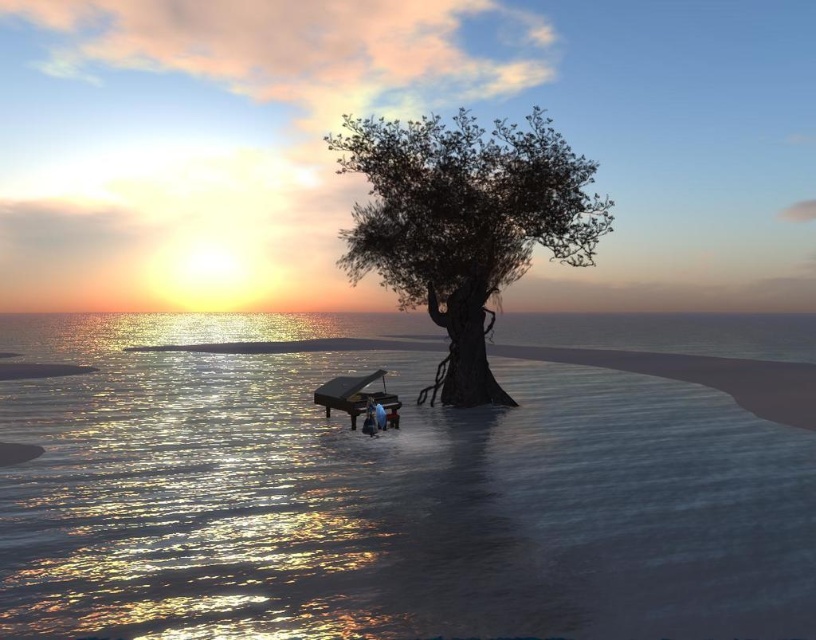
Can you confirm if shiny reflective water at center is shorter than green matte tree at center?

Indeed, shiny reflective water at center has a lesser height compared to green matte tree at center.

Can you confirm if shiny reflective water at center is positioned above green matte tree at center?

No, shiny reflective water at center is not above green matte tree at center.

Measure the distance between shiny reflective water at center and camera.

A distance of 5.52 meters exists between shiny reflective water at center and camera.

Identify the location of shiny reflective water at center. Image resolution: width=816 pixels, height=640 pixels. (384, 497).

Identify the location of green matte tree at center. 464,225.

Does green matte tree at center have a greater height compared to matte blue person at center?

Yes, green matte tree at center is taller than matte blue person at center.

Describe the element at coordinates (464, 225) in the screenshot. This screenshot has width=816, height=640. I see `green matte tree at center` at that location.

Identify the location of green matte tree at center. (464, 225).

Which is behind, point (624, 480) or point (377, 424)?

The point (377, 424) is more distant.

Is shiny reflective water at center bigger than matte blue person at center?

Indeed, shiny reflective water at center has a larger size compared to matte blue person at center.

Is point (606, 561) in front of point (377, 401)?

Yes, it is in front of point (377, 401).

Where is `shiny reflective water at center`? Image resolution: width=816 pixels, height=640 pixels. shiny reflective water at center is located at coordinates (384, 497).